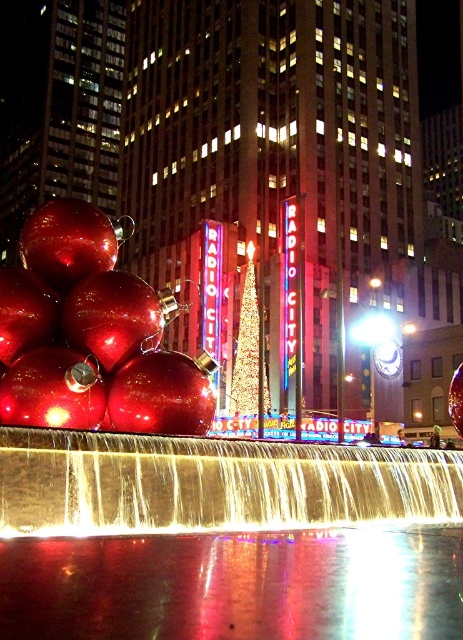
Question: Does reflective glass waterfall at center have a lesser width compared to gold glittering christmas tree at center?

Choices:
 (A) yes
 (B) no

Answer: (B)

Question: Is reflective glass waterfall at center to the right of gold glittering christmas tree at center from the viewer's perspective?

Choices:
 (A) yes
 (B) no

Answer: (B)

Question: Does reflective glass waterfall at center have a lesser width compared to gold glittering christmas tree at center?

Choices:
 (A) no
 (B) yes

Answer: (A)